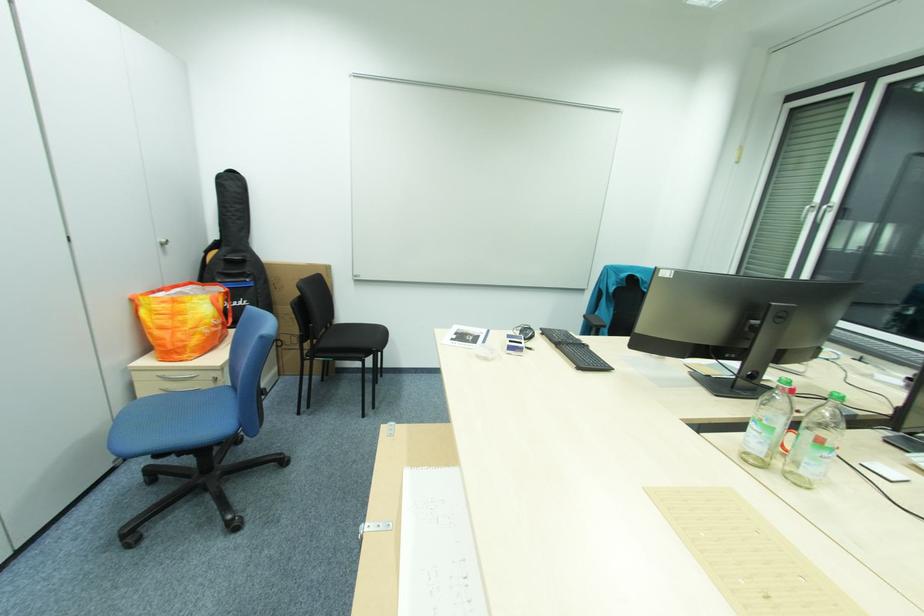
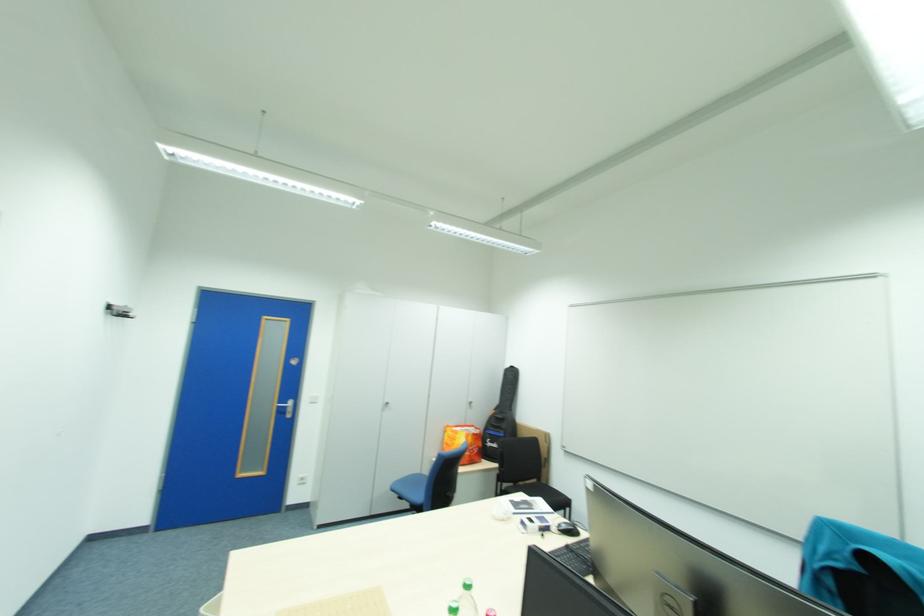
Where in the second image is the point corresponding to (315,345) from the first image?

(508, 484)